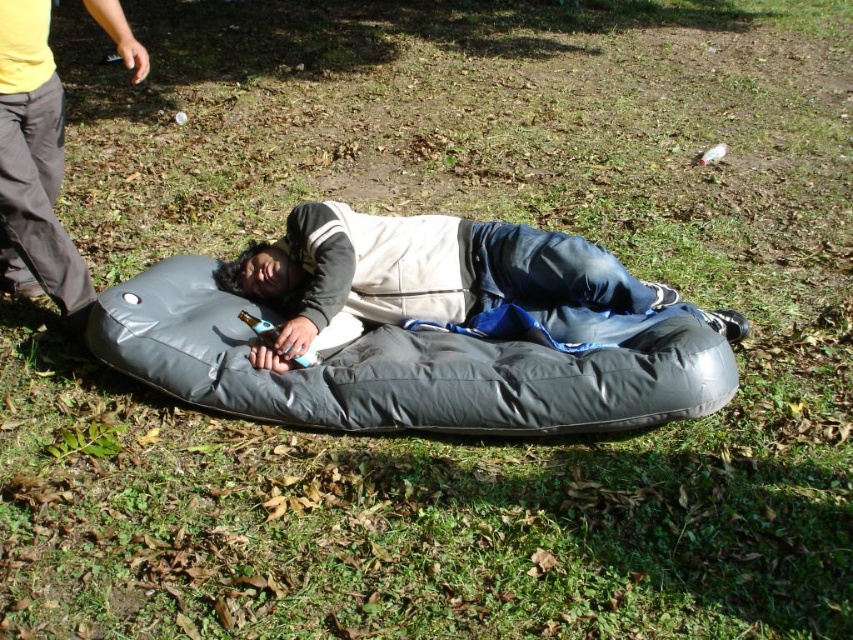
Question: Does matte gray sleeping bag at center appear on the left side of matte black inflatable at left?

Choices:
 (A) no
 (B) yes

Answer: (A)

Question: Which of these objects is positioned closest to the gray fabric bean bag chair at center?

Choices:
 (A) matte gray sleeping bag at center
 (B) matte black inflatable at left

Answer: (A)

Question: Is gray fabric bean bag chair at center in front of matte black inflatable at left?

Choices:
 (A) yes
 (B) no

Answer: (A)

Question: Which object is positioned farthest from the matte gray sleeping bag at center?

Choices:
 (A) gray fabric bean bag chair at center
 (B) matte black inflatable at left

Answer: (B)

Question: Which point is farther to the camera?

Choices:
 (A) matte gray sleeping bag at center
 (B) gray fabric bean bag chair at center
 (C) matte black inflatable at left

Answer: (A)

Question: Considering the relative positions of gray fabric bean bag chair at center and matte black inflatable at left in the image provided, where is gray fabric bean bag chair at center located with respect to matte black inflatable at left?

Choices:
 (A) above
 (B) below

Answer: (B)